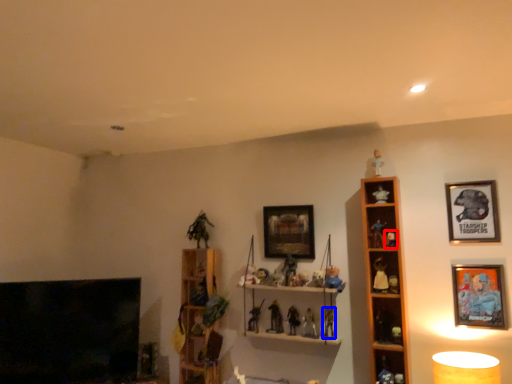
Question: Among these objects, which one is farthest to the camera, toy (highlighted by a red box) or toy (highlighted by a blue box)?

Choices:
 (A) toy
 (B) toy

Answer: (B)